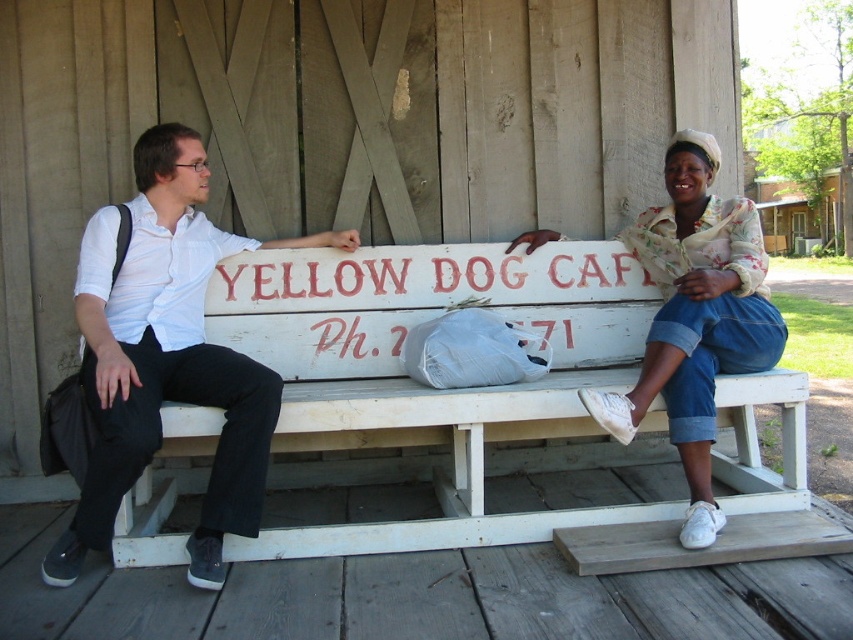
You are a customer at the Yellow Dog Cafe and want to sit down on the white wooden bench at center. However, there is a denim skirt at right nearby. Can you sit on the bench without moving the skirt?

The white wooden bench at center is positioned under denim skirt at right, so the bench is located beneath the skirt. Since the skirt is likely on the bench, you cannot sit there without moving it.

Consider the image. You are a photographer trying to capture a candid shot of the denim skirt at right without including the white wooden bench at center in the frame. Is this possible given their positions?

The denim skirt at right is behind the white wooden bench at center, so it would be blocked from view. Therefore, capturing the denim skirt at right without including the white wooden bench at center in the frame is not possible.